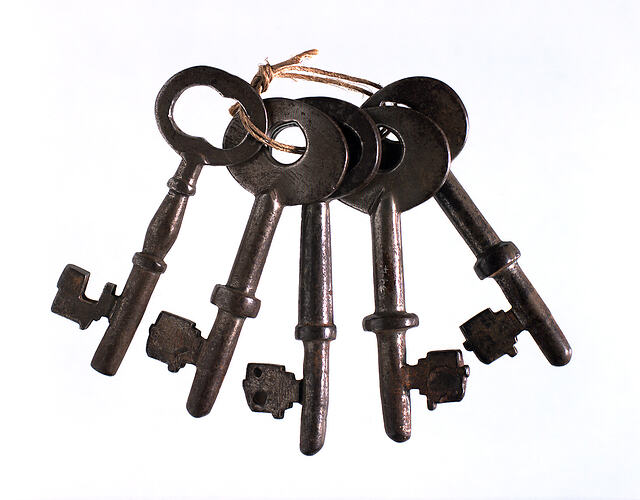
Identify the location of key hole. Image resolution: width=640 pixels, height=500 pixels. (210, 124).